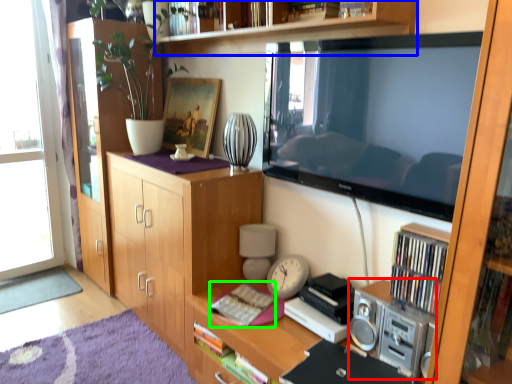
Question: Based on their relative distances, which object is nearer to stereo (highlighted by a red box)? Choose from shelf (highlighted by a blue box) and book (highlighted by a green box).

Choices:
 (A) shelf
 (B) book

Answer: (B)